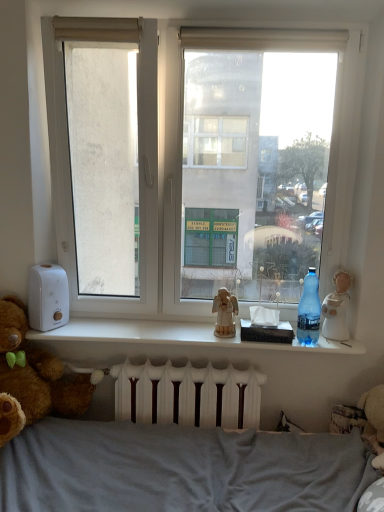
The height and width of the screenshot is (512, 384). What are the coordinates of `white fabric curtain at upper center` in the screenshot? It's located at (262, 39).

Describe the element at coordinates (33, 378) in the screenshot. I see `brown plush teddy bear at left` at that location.

Find the location of `white matte window sill at center`. white matte window sill at center is located at coordinates (176, 336).

This screenshot has height=512, width=384. In order to click on white fabric curtain at upper center in this screenshot , I will do `click(262, 39)`.

From a real-world perspective, relative to white ceramic figurine at right, which is the second figurine from left to right, is wooden angel at center, the second figurine from the right, vertically above or below?

In terms of real-world spatial position, wooden angel at center, the second figurine from the right, is below white ceramic figurine at right, which is the second figurine from left to right.

Does point (223, 292) come in front of point (346, 309)?

That is True.

Is wooden angel at center, arranged as the first figurine when viewed from the left, facing away from white ceramic figurine at right, which is the second figurine from left to right?

No, wooden angel at center, arranged as the first figurine when viewed from the left,'s orientation is not away from white ceramic figurine at right, which is the second figurine from left to right.

Considering the relative sizes of wooden angel at center, arranged as the first figurine when viewed from the left, and white ceramic figurine at right, which is the second figurine from left to right, in the image provided, is wooden angel at center, arranged as the first figurine when viewed from the left, taller than white ceramic figurine at right, which is the second figurine from left to right,?

No, wooden angel at center, arranged as the first figurine when viewed from the left, is not taller than white ceramic figurine at right, which is the second figurine from left to right.

Does point (333, 296) lie in front of point (220, 323)?

That is False.

Which of these two, white ceramic figurine at right, the first figurine viewed from the right, or wooden angel at center, arranged as the first figurine when viewed from the left, is wider?

white ceramic figurine at right, the first figurine viewed from the right, is wider.

From the image's perspective, which is above, white ceramic figurine at right, the first figurine viewed from the right, or wooden angel at center, arranged as the first figurine when viewed from the left?

From the image's view, white ceramic figurine at right, the first figurine viewed from the right, is above.

Between white ceramic figurine at right, which is the second figurine from left to right, and wooden angel at center, the second figurine from the right, which one has smaller size?

Smaller between the two is wooden angel at center, the second figurine from the right.

In the scene shown: From the image's perspective, which is above, white ceramic figurine at right, the first figurine viewed from the right, or white matte window sill at center?

white ceramic figurine at right, the first figurine viewed from the right, from the image's perspective.

How distant is white ceramic figurine at right, the first figurine viewed from the right, from white matte window sill at center?

white ceramic figurine at right, the first figurine viewed from the right, and white matte window sill at center are 17.51 inches apart from each other.

Is white ceramic figurine at right, which is the second figurine from left to right, taller or shorter than white matte window sill at center?

Clearly, white ceramic figurine at right, which is the second figurine from left to right, is taller compared to white matte window sill at center.

Does white ceramic figurine at right, the first figurine viewed from the right, have a greater width compared to white matte window sill at center?

No.

From a real-world perspective, does transparent glass window at center sit lower than blue plastic bottle at right?

No.

Which object is thinner, transparent glass window at center or blue plastic bottle at right?

With smaller width is blue plastic bottle at right.

Considering the positions of points (232, 302) and (89, 340), is point (232, 302) farther from camera compared to point (89, 340)?

Yes, it is behind point (89, 340).

What are the coordinates of `window sill in front of the wooden angel at center, arranged as the first figurine when viewed from the left` in the screenshot? It's located at (176, 336).

From the image's perspective, which one is positioned lower, wooden angel at center, arranged as the first figurine when viewed from the left, or white matte window sill at center?

white matte window sill at center is shown below in the image.

Between wooden angel at center, the second figurine from the right, and white matte window sill at center, which one has larger width?

Wider between the two is white matte window sill at center.

Would you say blue plastic bottle at right is part of brown plush teddy bear at left's contents?

Actually, blue plastic bottle at right is outside brown plush teddy bear at left.

From the image's perspective, is brown plush teddy bear at left on top of blue plastic bottle at right?

No, from the image's perspective, brown plush teddy bear at left is not above blue plastic bottle at right.

Considering the points (81, 401) and (305, 324), which point is behind, point (81, 401) or point (305, 324)?

The point (81, 401) is farther.

Measure the distance from brown plush teddy bear at left to white fabric curtain at upper center.

5.42 feet.

In the scene shown: From the image's perspective, is brown plush teddy bear at left above white fabric curtain at upper center?

No, from the image's perspective, brown plush teddy bear at left is not above white fabric curtain at upper center.

Considering the sizes of objects brown plush teddy bear at left and white fabric curtain at upper center in the image provided, who is thinner, brown plush teddy bear at left or white fabric curtain at upper center?

white fabric curtain at upper center.

What's the angular difference between brown plush teddy bear at left and white fabric curtain at upper center's facing directions?

There is a 0.00352-degree angle between the facing directions of brown plush teddy bear at left and white fabric curtain at upper center.

Where is `figurine on the right side of wooden angel at center, the second figurine from the right`? figurine on the right side of wooden angel at center, the second figurine from the right is located at coordinates point(337,308).

This screenshot has height=512, width=384. In order to click on figurine that is under the white ceramic figurine at right, the first figurine viewed from the right (from a real-world perspective) in this screenshot , I will do `click(225, 313)`.

In the scene shown: Based on their spatial positions, is wooden angel at center, arranged as the first figurine when viewed from the left, or brown plush teddy bear at left further from transparent glass window at center?

brown plush teddy bear at left.

Considering their positions, is brown plush teddy bear at left positioned closer to white fabric curtain at upper center than blue plastic bottle at right?

Based on the image, blue plastic bottle at right appears to be nearer to white fabric curtain at upper center.

From the image, which object appears to be farther from wooden angel at center, arranged as the first figurine when viewed from the left, brown plush teddy bear at left or transparent glass window at center?

Among the two, transparent glass window at center is located further to wooden angel at center, arranged as the first figurine when viewed from the left.

From the image, which object appears to be nearer to blue plastic bottle at right, white fabric curtain at upper center or white matte window sill at center?

The object closer to blue plastic bottle at right is white matte window sill at center.

From the image, which object appears to be nearer to brown plush teddy bear at left, white ceramic figurine at right, the first figurine viewed from the right, or wooden angel at center, arranged as the first figurine when viewed from the left?

The object closer to brown plush teddy bear at left is wooden angel at center, arranged as the first figurine when viewed from the left.

Consider the image. From the image, which object appears to be nearer to blue plastic bottle at right, brown plush teddy bear at left or white matte window sill at center?

white matte window sill at center is positioned closer to the anchor blue plastic bottle at right.

Based on their spatial positions, is white matte window sill at center or brown plush teddy bear at left closer to transparent glass window at center?

white matte window sill at center.

Which object lies further to the anchor point brown plush teddy bear at left, white matte window sill at center or white fabric curtain at upper center?

Based on the image, white fabric curtain at upper center appears to be further to brown plush teddy bear at left.

At what (x,y) coordinates should I click in order to perform the action: click on window sill between brown plush teddy bear at left and blue plastic bottle at right from left to right. Please return your answer as a coordinate pair (x, y). Looking at the image, I should click on (176, 336).

At what (x,y) coordinates should I click in order to perform the action: click on bottle that lies between white fabric curtain at upper center and wooden angel at center, the second figurine from the right, from top to bottom. Please return your answer as a coordinate pair (x, y). The image size is (384, 512). Looking at the image, I should click on (309, 310).

The width and height of the screenshot is (384, 512). In order to click on window between white fabric curtain at upper center and blue plastic bottle at right in the vertical direction in this screenshot , I will do `click(215, 173)`.

Where is `bottle between white fabric curtain at upper center and white ceramic figurine at right, which is the second figurine from left to right, in the up-down direction`? Image resolution: width=384 pixels, height=512 pixels. bottle between white fabric curtain at upper center and white ceramic figurine at right, which is the second figurine from left to right, in the up-down direction is located at coordinates (309, 310).